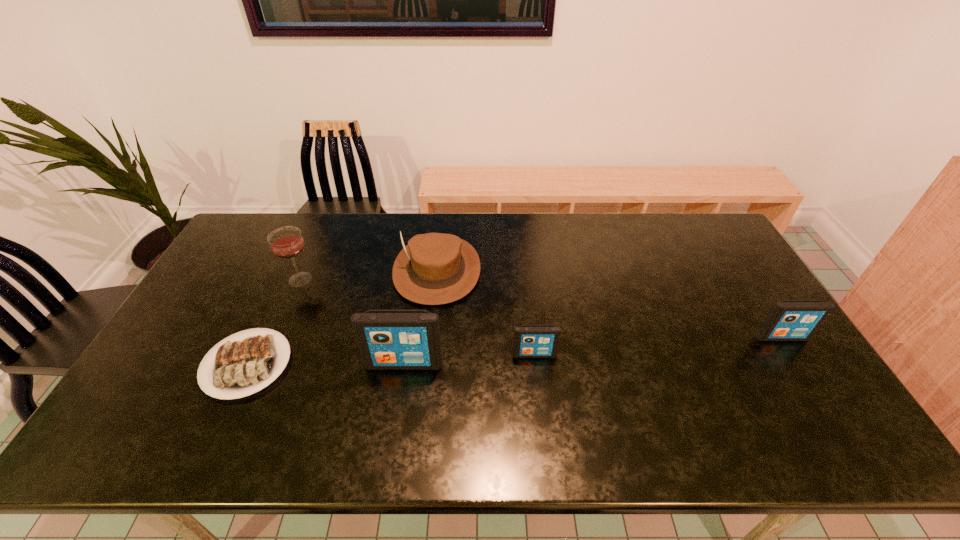
In the image, there is a desktop. Where is `vacant area at the near edge`? This screenshot has width=960, height=540. vacant area at the near edge is located at coordinates (600, 397).

This screenshot has width=960, height=540. Find the location of `free space at the left edge of the desktop`. free space at the left edge of the desktop is located at coordinates (248, 268).

Find the location of a particular element. The image size is (960, 540). vacant space at the right edge of the desktop is located at coordinates (754, 282).

In the image, there is a desktop. What are the coordinates of `free region at the far left corner` in the screenshot? It's located at click(x=289, y=215).

Locate an element on the screen. blank space at the far right corner of the desktop is located at coordinates (687, 231).

This screenshot has width=960, height=540. Identify the location of free region at the near right corner of the desktop. (820, 413).

Where is `vacant space that's between the fedora and the shortest object`? vacant space that's between the fedora and the shortest object is located at coordinates (342, 318).

Where is `vacant region between the shortest iPod and the fedora`? The width and height of the screenshot is (960, 540). vacant region between the shortest iPod and the fedora is located at coordinates (486, 312).

At what (x,y) coordinates should I click in order to perform the action: click on vacant area between the rightmost object and the second iPod from right to left. Please return your answer as a coordinate pair (x, y). Looking at the image, I should click on (658, 346).

The image size is (960, 540). Find the location of `object that ranks as the third closest to the rightmost iPod`. object that ranks as the third closest to the rightmost iPod is located at coordinates (387, 339).